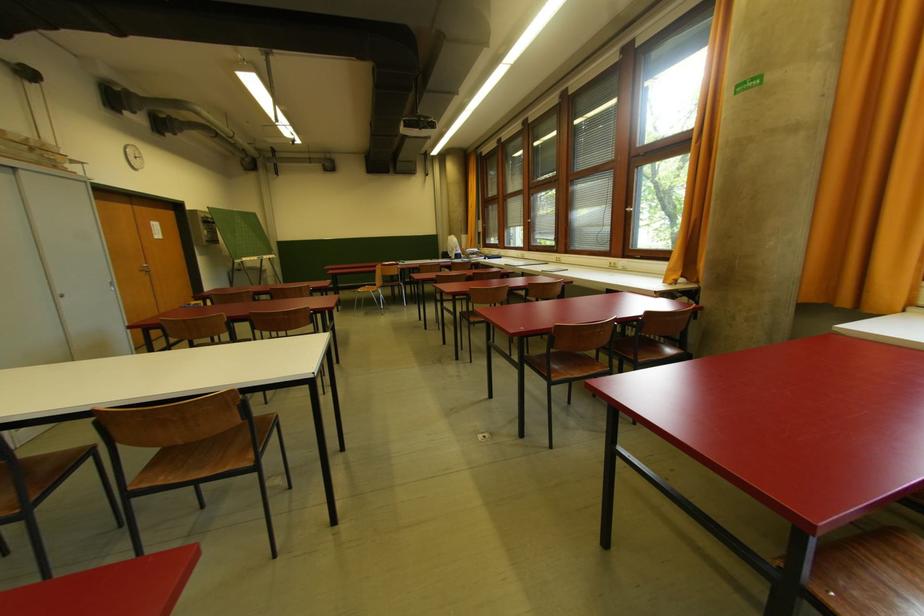
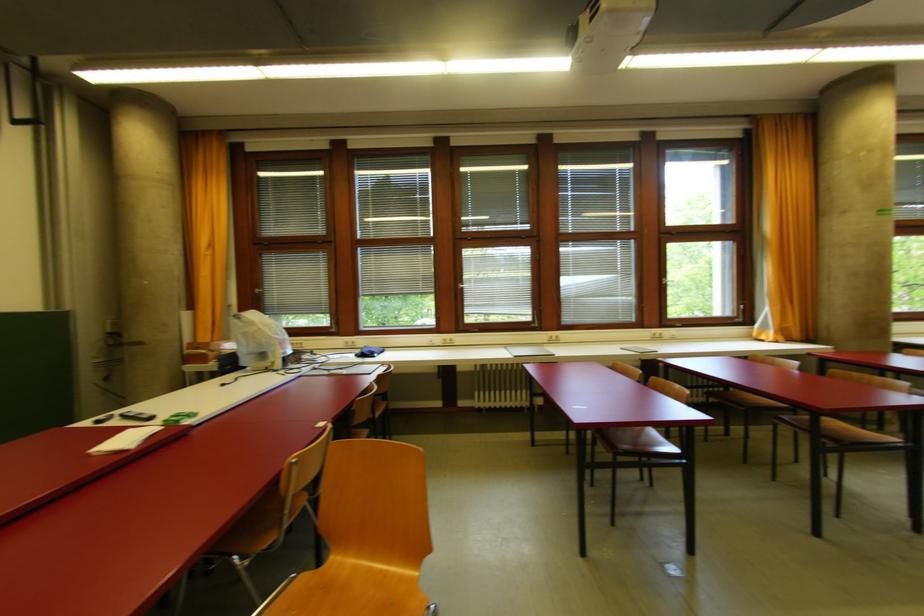
The point at (531,223) is marked in the first image. Where is the corresponding point in the second image?

(465, 288)